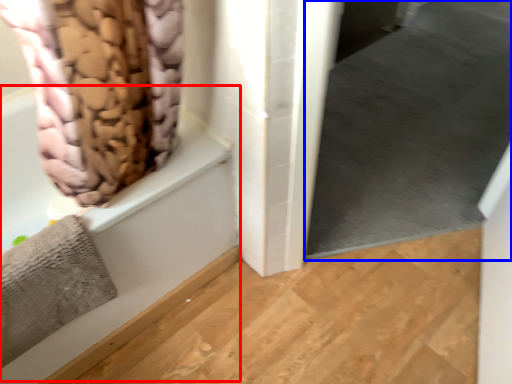
Question: Which of the following is the closest to the observer, bath (highlighted by a red box) or window screen (highlighted by a blue box)?

Choices:
 (A) bath
 (B) window screen

Answer: (A)